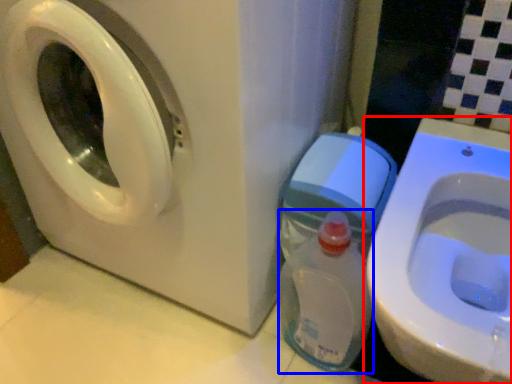
Question: Among these objects, which one is nearest to the camera, toilet (highlighted by a red box) or baby bottle (highlighted by a blue box)?

Choices:
 (A) toilet
 (B) baby bottle

Answer: (A)